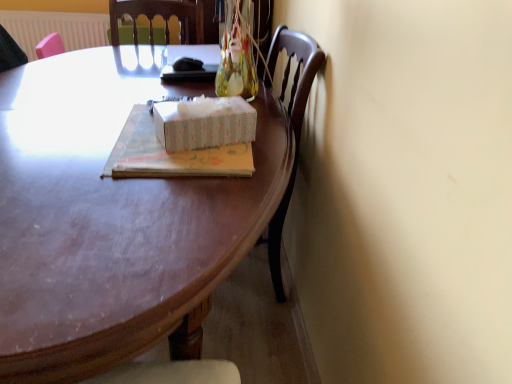
Identify the location of free space above white textured radiator at upper left (from a real-world perspective). (69, 12).